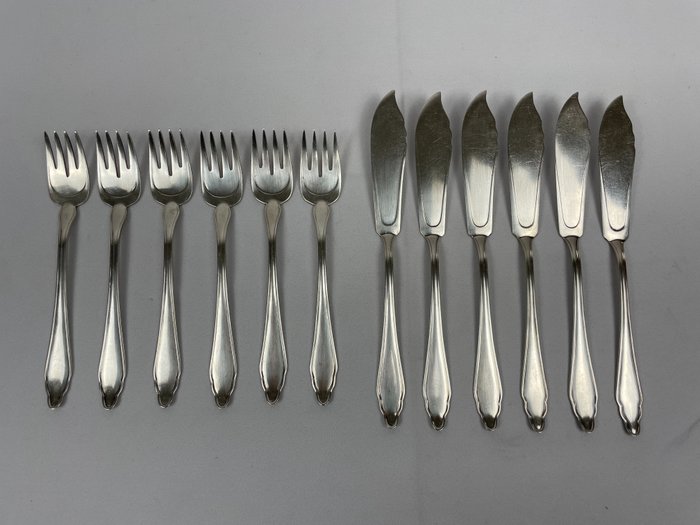
Locate an element on the screen. forks is located at coordinates (318, 217), (272, 218), (222, 212), (174, 215), (113, 215), (64, 216).